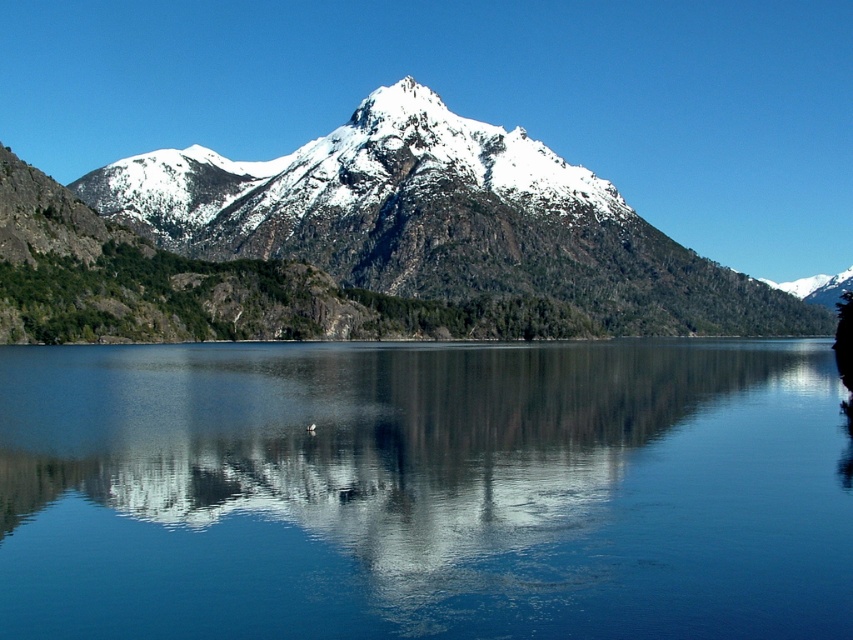
You are a photographer planning to take a photo of the snowy rocky mountain at center from the smooth blue water at center. Given that your camera can focus up to 150 meters, will you be able to capture the mountain clearly?

The distance between the smooth blue water at center and the snowy rocky mountain at center is 137.93 meters, which is within the camera focus range of 150 meters. Therefore, you can capture the mountain clearly.

You are standing at the edge of the lake in the serene landscape scene. You notice two points marked in the image. The first point is at coordinates point (782,532), and the second point is at coordinates point (119,168). Which of these two points is closer to you, the observer?

Point (782,532) is closer to the viewer than point (119,168).